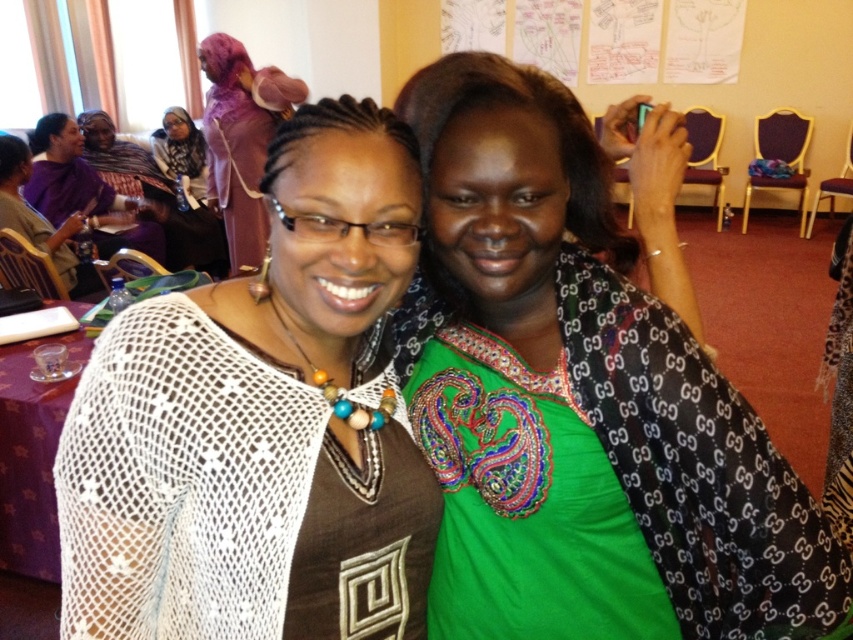
Question: Which object is closer to the camera taking this photo?

Choices:
 (A) purple fabric at left
 (B) purple satin hijab at upper left
 (C) white paper at upper center
 (D) matte black hijab at upper left

Answer: (A)

Question: Which object is the closest to the white mesh sweater at left?

Choices:
 (A) matte black hijab at upper left
 (B) purple fabric at left
 (C) green embroidered blouse at center

Answer: (C)

Question: Can you confirm if white paper at upper center is positioned to the right of purple fabric at left?

Choices:
 (A) no
 (B) yes

Answer: (B)

Question: Considering the relative positions of white paper at upper center and purple fabric at left in the image provided, where is white paper at upper center located with respect to purple fabric at left?

Choices:
 (A) above
 (B) below

Answer: (A)

Question: Is white mesh sweater at left to the right of white paper at upper center from the viewer's perspective?

Choices:
 (A) yes
 (B) no

Answer: (B)

Question: Which object is farther from the camera taking this photo?

Choices:
 (A) matte black hijab at upper left
 (B) green embroidered blouse at center
 (C) purple satin hijab at upper left

Answer: (A)